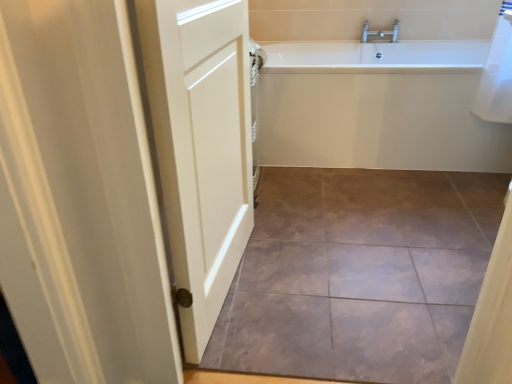
Question: Considering the relative sizes of brown textured tile at center and white matte door at left in the image provided, is brown textured tile at center taller than white matte door at left?

Choices:
 (A) no
 (B) yes

Answer: (A)

Question: Does brown textured tile at center come in front of white matte door at left?

Choices:
 (A) no
 (B) yes

Answer: (A)

Question: Does brown textured tile at center have a lesser width compared to white matte door at left?

Choices:
 (A) yes
 (B) no

Answer: (B)

Question: Is brown textured tile at center positioned far away from white matte door at left?

Choices:
 (A) no
 (B) yes

Answer: (A)

Question: Could you tell me if brown textured tile at center is facing white matte door at left?

Choices:
 (A) no
 (B) yes

Answer: (A)

Question: Does point (278, 188) appear closer or farther from the camera than point (499, 170)?

Choices:
 (A) closer
 (B) farther

Answer: (A)

Question: Is brown textured tile at center bigger or smaller than white glossy bathtub at upper right?

Choices:
 (A) big
 (B) small

Answer: (B)

Question: From the image's perspective, is brown textured tile at center located above or below white glossy bathtub at upper right?

Choices:
 (A) above
 (B) below

Answer: (B)

Question: Considering the positions of brown textured tile at center and white glossy bathtub at upper right in the image, is brown textured tile at center taller or shorter than white glossy bathtub at upper right?

Choices:
 (A) short
 (B) tall

Answer: (A)

Question: Is point (242, 178) closer or farther from the camera than point (261, 284)?

Choices:
 (A) farther
 (B) closer

Answer: (A)

Question: Would you say white matte door at left is to the left or to the right of brown textured tile at center in the picture?

Choices:
 (A) right
 (B) left

Answer: (B)

Question: In terms of height, does white matte door at left look taller or shorter compared to brown textured tile at center?

Choices:
 (A) tall
 (B) short

Answer: (A)

Question: In terms of size, does white matte door at left appear bigger or smaller than brown textured tile at center?

Choices:
 (A) small
 (B) big

Answer: (B)

Question: From their relative heights in the image, would you say white glossy bathtub at upper right is taller or shorter than white matte door at left?

Choices:
 (A) short
 (B) tall

Answer: (A)

Question: From a real-world perspective, is white glossy bathtub at upper right positioned above or below white matte door at left?

Choices:
 (A) below
 (B) above

Answer: (A)